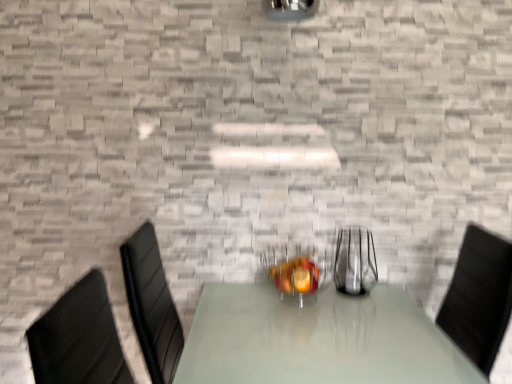
Find the location of a particular element. metallic silver fruit bowl at center, placed as the 2th tableware when sorted from right to left is located at coordinates (294, 273).

The image size is (512, 384). What do you see at coordinates (294, 273) in the screenshot?
I see `metallic silver fruit bowl at center, placed as the 2th tableware when sorted from right to left` at bounding box center [294, 273].

What is the approximate height of metallic silver fruit bowl at center, positioned as the first tableware in left-to-right order?

It is 5.91 inches.

Image resolution: width=512 pixels, height=384 pixels. I want to click on clear glass vase at center, which is the second tableware from left to right, so tap(355, 261).

Image resolution: width=512 pixels, height=384 pixels. What do you see at coordinates (355, 261) in the screenshot? I see `clear glass vase at center, the first tableware from the right` at bounding box center [355, 261].

Where is `metallic silver fruit bowl at center, placed as the 2th tableware when sorted from right to left`? The width and height of the screenshot is (512, 384). metallic silver fruit bowl at center, placed as the 2th tableware when sorted from right to left is located at coordinates (294, 273).

Which is more to the left, metallic silver fruit bowl at center, positioned as the first tableware in left-to-right order, or clear glass vase at center, the first tableware from the right?

Positioned to the left is metallic silver fruit bowl at center, positioned as the first tableware in left-to-right order.

Is the depth of metallic silver fruit bowl at center, placed as the 2th tableware when sorted from right to left, less than that of clear glass vase at center, the first tableware from the right?

Yes, metallic silver fruit bowl at center, placed as the 2th tableware when sorted from right to left, is in front of clear glass vase at center, the first tableware from the right.

Which point is more distant from viewer, (322, 260) or (347, 246)?

Point (347, 246)

From the image's perspective, which is above, metallic silver fruit bowl at center, positioned as the first tableware in left-to-right order, or clear glass vase at center, which is the second tableware from left to right?

clear glass vase at center, which is the second tableware from left to right, from the image's perspective.

Looking at this image, from a real-world perspective, between metallic silver fruit bowl at center, positioned as the first tableware in left-to-right order, and clear glass vase at center, the first tableware from the right, who is vertically higher?

In real-world perspective, clear glass vase at center, the first tableware from the right, is above.

Can you confirm if metallic silver fruit bowl at center, placed as the 2th tableware when sorted from right to left, is thinner than clear glass vase at center, which is the second tableware from left to right?

In fact, metallic silver fruit bowl at center, placed as the 2th tableware when sorted from right to left, might be wider than clear glass vase at center, which is the second tableware from left to right.

Which of these two, metallic silver fruit bowl at center, positioned as the first tableware in left-to-right order, or clear glass vase at center, which is the second tableware from left to right, stands taller?

clear glass vase at center, which is the second tableware from left to right, is taller.

Is metallic silver fruit bowl at center, positioned as the first tableware in left-to-right order, bigger than clear glass vase at center, the first tableware from the right?

Yes.

Is metallic silver fruit bowl at center, positioned as the first tableware in left-to-right order, not within clear glass vase at center, the first tableware from the right?

Yes.

Are metallic silver fruit bowl at center, positioned as the first tableware in left-to-right order, and clear glass vase at center, which is the second tableware from left to right, beside each other?

There is a gap between metallic silver fruit bowl at center, positioned as the first tableware in left-to-right order, and clear glass vase at center, which is the second tableware from left to right.

Is metallic silver fruit bowl at center, placed as the 2th tableware when sorted from right to left, positioned with its back to clear glass vase at center, the first tableware from the right?

No.

Can you tell me how much metallic silver fruit bowl at center, placed as the 2th tableware when sorted from right to left, and clear glass vase at center, which is the second tableware from left to right, differ in facing direction?

The angle between the facing direction of metallic silver fruit bowl at center, placed as the 2th tableware when sorted from right to left, and the facing direction of clear glass vase at center, which is the second tableware from left to right, is 2.05 degrees.

This screenshot has width=512, height=384. Identify the location of tableware to the right of metallic silver fruit bowl at center, placed as the 2th tableware when sorted from right to left. (355, 261).

Would you say clear glass vase at center, which is the second tableware from left to right, is to the left or to the right of metallic silver fruit bowl at center, placed as the 2th tableware when sorted from right to left, in the picture?

Clearly, clear glass vase at center, which is the second tableware from left to right, is on the right of metallic silver fruit bowl at center, placed as the 2th tableware when sorted from right to left, in the image.

Is clear glass vase at center, the first tableware from the right, in front of metallic silver fruit bowl at center, positioned as the first tableware in left-to-right order?

No, clear glass vase at center, the first tableware from the right, is further to the viewer.

Is point (367, 281) positioned behind point (306, 263)?

That is True.

From the image's perspective, is clear glass vase at center, which is the second tableware from left to right, above or below metallic silver fruit bowl at center, positioned as the first tableware in left-to-right order?

From the image's perspective, clear glass vase at center, which is the second tableware from left to right, appears above metallic silver fruit bowl at center, positioned as the first tableware in left-to-right order.

From a real-world perspective, which is physically above, clear glass vase at center, which is the second tableware from left to right, or metallic silver fruit bowl at center, placed as the 2th tableware when sorted from right to left?

clear glass vase at center, which is the second tableware from left to right, is physically above.

Considering the sizes of objects clear glass vase at center, the first tableware from the right, and metallic silver fruit bowl at center, positioned as the first tableware in left-to-right order, in the image provided, who is thinner, clear glass vase at center, the first tableware from the right, or metallic silver fruit bowl at center, positioned as the first tableware in left-to-right order,?

clear glass vase at center, the first tableware from the right, is thinner.

Is clear glass vase at center, which is the second tableware from left to right, taller than metallic silver fruit bowl at center, placed as the 2th tableware when sorted from right to left?

Yes, clear glass vase at center, which is the second tableware from left to right, is taller than metallic silver fruit bowl at center, placed as the 2th tableware when sorted from right to left.

Is clear glass vase at center, the first tableware from the right, bigger than metallic silver fruit bowl at center, placed as the 2th tableware when sorted from right to left?

Actually, clear glass vase at center, the first tableware from the right, might be smaller than metallic silver fruit bowl at center, placed as the 2th tableware when sorted from right to left.

Could metallic silver fruit bowl at center, positioned as the first tableware in left-to-right order, be considered to be inside clear glass vase at center, which is the second tableware from left to right?

No, metallic silver fruit bowl at center, positioned as the first tableware in left-to-right order, is not inside clear glass vase at center, which is the second tableware from left to right.

Is clear glass vase at center, which is the second tableware from left to right, in contact with metallic silver fruit bowl at center, positioned as the first tableware in left-to-right order?

clear glass vase at center, which is the second tableware from left to right, and metallic silver fruit bowl at center, positioned as the first tableware in left-to-right order, are not in contact.

Could you tell me if clear glass vase at center, the first tableware from the right, is facing metallic silver fruit bowl at center, placed as the 2th tableware when sorted from right to left?

No, clear glass vase at center, the first tableware from the right, is not facing towards metallic silver fruit bowl at center, placed as the 2th tableware when sorted from right to left.

What's the angular difference between clear glass vase at center, the first tableware from the right, and metallic silver fruit bowl at center, placed as the 2th tableware when sorted from right to left,'s facing directions?

They differ by 2.05 degrees in their facing directions.

Based on the photo, measure the distance from clear glass vase at center, the first tableware from the right, to metallic silver fruit bowl at center, placed as the 2th tableware when sorted from right to left.

The distance of clear glass vase at center, the first tableware from the right, from metallic silver fruit bowl at center, placed as the 2th tableware when sorted from right to left, is 5.94 inches.

This screenshot has height=384, width=512. What are the coordinates of `tableware behind the metallic silver fruit bowl at center, placed as the 2th tableware when sorted from right to left` in the screenshot? It's located at (355, 261).

The width and height of the screenshot is (512, 384). In order to click on tableware lying above the metallic silver fruit bowl at center, placed as the 2th tableware when sorted from right to left (from the image's perspective) in this screenshot , I will do 355,261.

The width and height of the screenshot is (512, 384). I want to click on tableware above the metallic silver fruit bowl at center, positioned as the first tableware in left-to-right order (from a real-world perspective), so click(355, 261).